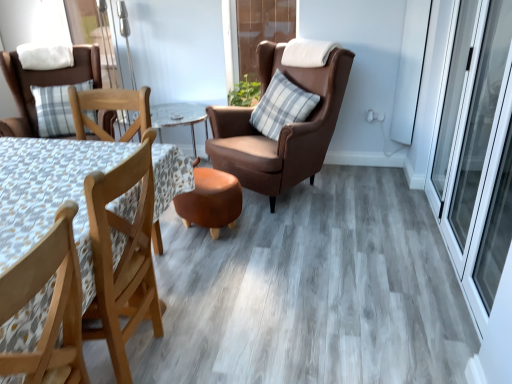
This screenshot has width=512, height=384. In order to click on matte brown chair at left, the first chair from the left in this screenshot , I will do `click(42, 85)`.

In terms of height, does brown leather screen door at upper center, which is the first screen door from left to right, look taller or shorter compared to white soft pillow at upper left, marked as the 1th pillow in a left-to-right arrangement?

In the image, brown leather screen door at upper center, which is the first screen door from left to right, appears to be taller than white soft pillow at upper left, marked as the 1th pillow in a left-to-right arrangement.

Is white soft pillow at upper left, which is the 1th pillow in top-to-bottom order, completely or partially inside brown leather screen door at upper center, which is the first screen door from left to right?

No, white soft pillow at upper left, which is the 1th pillow in top-to-bottom order, is not surrounded by brown leather screen door at upper center, which is the first screen door from left to right.

Between brown leather screen door at upper center, the 2th screen door positioned from the right, and white soft pillow at upper left, arranged as the 2th pillow when viewed from the right, which one appears on the right side from the viewer's perspective?

Positioned to the right is brown leather screen door at upper center, the 2th screen door positioned from the right.

Is there a large distance between brown leather screen door at upper center, the 2th screen door positioned from the right, and wooden chair at lower left, marked as the 1th chair in a front-to-back arrangement?

That's right, there is a large distance between brown leather screen door at upper center, the 2th screen door positioned from the right, and wooden chair at lower left, marked as the 1th chair in a front-to-back arrangement.

Considering the positions of objects brown leather screen door at upper center, which is the first screen door from left to right, and wooden chair at lower left, the second chair from the right, in the image provided, who is behind, brown leather screen door at upper center, which is the first screen door from left to right, or wooden chair at lower left, the second chair from the right,?

brown leather screen door at upper center, which is the first screen door from left to right, is more distant.

Does brown leather screen door at upper center, which is the first screen door from left to right, have a greater height compared to wooden chair at lower left, placed as the 2th chair when sorted from left to right?

Indeed, brown leather screen door at upper center, which is the first screen door from left to right, has a greater height compared to wooden chair at lower left, placed as the 2th chair when sorted from left to right.

How much distance is there between brown leather screen door at upper center, the 2th screen door in the front-to-back sequence, and wooden chair at lower left, marked as the 1th chair in a front-to-back arrangement?

brown leather screen door at upper center, the 2th screen door in the front-to-back sequence, is 9.51 feet from wooden chair at lower left, marked as the 1th chair in a front-to-back arrangement.

How many degrees apart are the facing directions of wooden chair at lower left, placed as the 2th chair when sorted from left to right, and wooden table at left?

There is a 0.000678-degree angle between the facing directions of wooden chair at lower left, placed as the 2th chair when sorted from left to right, and wooden table at left.

Considering the sizes of objects wooden chair at lower left, marked as the 1th chair in a front-to-back arrangement, and wooden table at left in the image provided, who is wider, wooden chair at lower left, marked as the 1th chair in a front-to-back arrangement, or wooden table at left?

wooden table at left.

From a real-world perspective, is wooden chair at lower left, the second chair from the right, positioned under wooden table at left based on gravity?

No, from a real-world perspective, wooden chair at lower left, the second chair from the right, is not beneath wooden table at left.

Looking at this image, between wooden chair at lower left, the third chair viewed from the back, and wooden table at left, which one has larger size?

Bigger between the two is wooden table at left.

Is transparent glass screen door at right, acting as the first screen door starting from the right, touching blue plaid pillow at center, arranged as the 2th pillow when viewed from the top?

No, transparent glass screen door at right, acting as the first screen door starting from the right, is not next to blue plaid pillow at center, arranged as the 2th pillow when viewed from the top.

Is transparent glass screen door at right, acting as the first screen door starting from the right, smaller than blue plaid pillow at center, positioned as the first pillow in right-to-left order?

No, transparent glass screen door at right, acting as the first screen door starting from the right, is not smaller than blue plaid pillow at center, positioned as the first pillow in right-to-left order.

What's the angular difference between transparent glass screen door at right, the first screen door from the front, and blue plaid pillow at center, arranged as the 2th pillow when viewed from the top,'s facing directions?

The angular difference between transparent glass screen door at right, the first screen door from the front, and blue plaid pillow at center, arranged as the 2th pillow when viewed from the top, is 63.1 degrees.

Considering their positions, is transparent glass screen door at right, which is the 2th screen door from left to right, located in front of or behind blue plaid pillow at center, arranged as the 2th pillow when viewed from the top?

transparent glass screen door at right, which is the 2th screen door from left to right, is in front of blue plaid pillow at center, arranged as the 2th pillow when viewed from the top.

Which object is wider, transparent glass screen door at right, which is counted as the second screen door, starting from the back, or white soft pillow at upper left, marked as the 1th pillow in a left-to-right arrangement?

Wider between the two is white soft pillow at upper left, marked as the 1th pillow in a left-to-right arrangement.

Does transparent glass screen door at right, which is the 2th screen door from left to right, contain white soft pillow at upper left, marked as the 1th pillow in a left-to-right arrangement?

No, transparent glass screen door at right, which is the 2th screen door from left to right, does not contain white soft pillow at upper left, marked as the 1th pillow in a left-to-right arrangement.

Is transparent glass screen door at right, the first screen door from the front, oriented away from white soft pillow at upper left, positioned as the second pillow in bottom-to-top order?

No, transparent glass screen door at right, the first screen door from the front, is not facing the opposite direction of white soft pillow at upper left, positioned as the second pillow in bottom-to-top order.

Locate an element on the screen. Image resolution: width=512 pixels, height=384 pixels. the 2nd screen door directly beneath the white soft pillow at upper left, arranged as the 2th pillow when viewed from the right (from a real-world perspective) is located at coordinates (477, 152).

From a real-world perspective, which is physically above, matte brown chair at left, the third chair when ordered from front to back, or transparent glass screen door at right, acting as the first screen door starting from the right?

matte brown chair at left, the third chair when ordered from front to back, is physically above.

You are a GUI agent. You are given a task and a screenshot of the screen. Output one action in this format:
    pyautogui.click(x=<x>, y=<y>)
    Task: Click on the screen door below the matte brown chair at left, the first chair from the left (from a real-world perspective)
    
    Given the screenshot: What is the action you would take?
    (x=477, y=152)

From the image's perspective, is brown leather chair at center, positioned as the first chair in right-to-left order, above or below brown leather screen door at upper center, the 2th screen door positioned from the right?

brown leather chair at center, positioned as the first chair in right-to-left order, is situated lower than brown leather screen door at upper center, the 2th screen door positioned from the right, in the image.

Which point is more distant from viewer, (298, 141) or (263, 11)?

Positioned behind is point (263, 11).

Would you say brown leather chair at center, positioned as the first chair in right-to-left order, is a long distance from brown leather screen door at upper center, the 2th screen door positioned from the right?

Actually, brown leather chair at center, positioned as the first chair in right-to-left order, and brown leather screen door at upper center, the 2th screen door positioned from the right, are a little close together.

Considering the sizes of objects brown leather chair at center, which is the 2th chair in front-to-back order, and brown leather screen door at upper center, the 1th screen door positioned from the back, in the image provided, who is wider, brown leather chair at center, which is the 2th chair in front-to-back order, or brown leather screen door at upper center, the 1th screen door positioned from the back,?

With larger width is brown leather chair at center, which is the 2th chair in front-to-back order.

This screenshot has width=512, height=384. What are the coordinates of `the 1st pillow positioned below the brown leather screen door at upper center, the 1th screen door positioned from the back (from the image's perspective)` in the screenshot? It's located at (45, 55).

Starting from the brown leather screen door at upper center, the 2th screen door in the front-to-back sequence, which chair is the 1st one to the left? Please provide its 2D coordinates.

[(49, 307)]

Which object lies further to the anchor point matte brown chair at left, the first chair from the left, wooden table at left or brown leather screen door at upper center, the 2th screen door positioned from the right?

wooden table at left is further to matte brown chair at left, the first chair from the left.

Looking at the image, which one is located further to matte brown chair at left, the third chair when ordered from front to back, wooden chair at lower left, the second chair from the right, or brown leather screen door at upper center, which is the first screen door from left to right?

The object further to matte brown chair at left, the third chair when ordered from front to back, is wooden chair at lower left, the second chair from the right.

From the image, which object appears to be farther from matte brown chair at left, the first chair from the left, wooden chair at lower left, the third chair viewed from the back, or white soft pillow at upper left, arranged as the 2th pillow when viewed from the right?

The object further to matte brown chair at left, the first chair from the left, is wooden chair at lower left, the third chair viewed from the back.

Which object lies further to the anchor point transparent glass screen door at right, acting as the first screen door starting from the right, brown leather screen door at upper center, the 1th screen door positioned from the back, or wooden table at left?

wooden table at left is further to transparent glass screen door at right, acting as the first screen door starting from the right.

Based on their spatial positions, is white soft pillow at upper left, arranged as the 2th pillow when viewed from the right, or wooden chair at lower left, placed as the 2th chair when sorted from left to right, closer to wooden table at left?

wooden chair at lower left, placed as the 2th chair when sorted from left to right, is positioned closer to the anchor wooden table at left.

From the image, which object appears to be nearer to brown leather screen door at upper center, which is the first screen door from left to right, matte brown chair at left, the first chair from the left, or transparent glass screen door at right, which is the 2th screen door from left to right?

Among the two, matte brown chair at left, the first chair from the left, is located nearer to brown leather screen door at upper center, which is the first screen door from left to right.

Looking at the image, which one is located closer to blue plaid pillow at center, positioned as the first pillow in right-to-left order, brown leather chair at center, the 3th chair viewed from the left, or matte brown chair at left, the third chair when ordered from front to back?

Based on the image, brown leather chair at center, the 3th chair viewed from the left, appears to be nearer to blue plaid pillow at center, positioned as the first pillow in right-to-left order.

When comparing their distances from wooden table at left, does matte brown chair at left, the first chair from the left, or brown leather screen door at upper center, the 2th screen door in the front-to-back sequence, seem closer?

Among the two, matte brown chair at left, the first chair from the left, is located nearer to wooden table at left.

The height and width of the screenshot is (384, 512). Find the location of `pillow between white soft pillow at upper left, marked as the 1th pillow in a left-to-right arrangement, and transparent glass screen door at right, which is the 2th screen door from left to right, from left to right`. pillow between white soft pillow at upper left, marked as the 1th pillow in a left-to-right arrangement, and transparent glass screen door at right, which is the 2th screen door from left to right, from left to right is located at coordinates (281, 106).

The width and height of the screenshot is (512, 384). Identify the location of screen door between wooden table at left and brown leather screen door at upper center, which is the first screen door from left to right, along the z-axis. (477, 152).

Where is `pillow located between matte brown chair at left, the first chair from the left, and transparent glass screen door at right, acting as the first screen door starting from the right, in the left-right direction`? The image size is (512, 384). pillow located between matte brown chair at left, the first chair from the left, and transparent glass screen door at right, acting as the first screen door starting from the right, in the left-right direction is located at coordinates (281, 106).

The height and width of the screenshot is (384, 512). Identify the location of screen door between white soft pillow at upper left, arranged as the 2th pillow when viewed from the right, and brown leather chair at center, which ranks as the 2th chair in back-to-front order, in the horizontal direction. (262, 29).